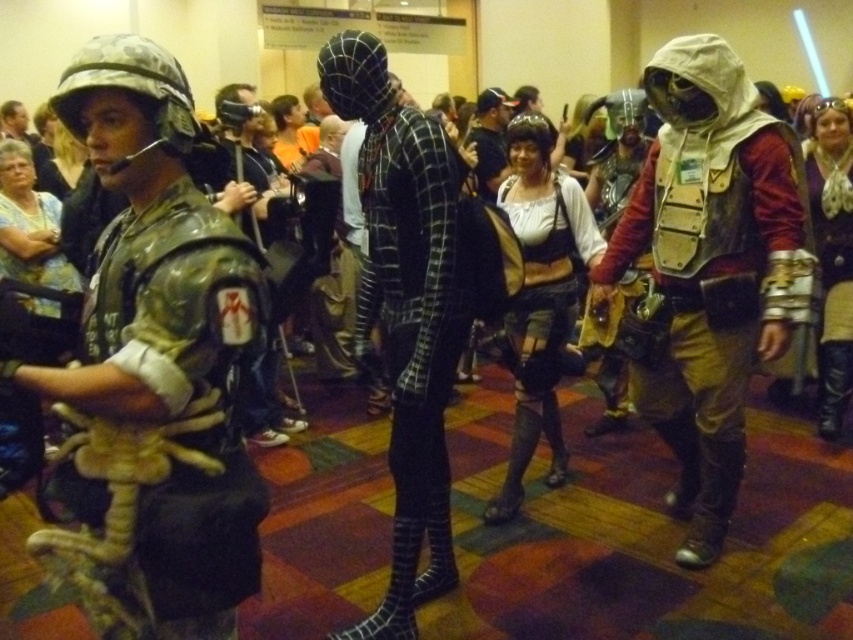
Question: Can you confirm if metallic armor at left is thinner than leather armor at right?

Choices:
 (A) yes
 (B) no

Answer: (A)

Question: Which object is positioned closest to the metallic armor at left?

Choices:
 (A) black spandex suit at center
 (B) leather armor at right

Answer: (A)

Question: Based on their relative distances, which object is farther from the metallic armor at left?

Choices:
 (A) black spandex suit at center
 (B) leather armor at right

Answer: (B)

Question: Does leather armor at right appear on the right side of black spandex suit at center?

Choices:
 (A) yes
 (B) no

Answer: (A)

Question: Which point is farther to the camera?

Choices:
 (A) (740, 404)
 (B) (231, 618)
 (C) (393, 93)

Answer: (A)

Question: Can you confirm if metallic armor at left is bigger than leather armor at right?

Choices:
 (A) yes
 (B) no

Answer: (B)